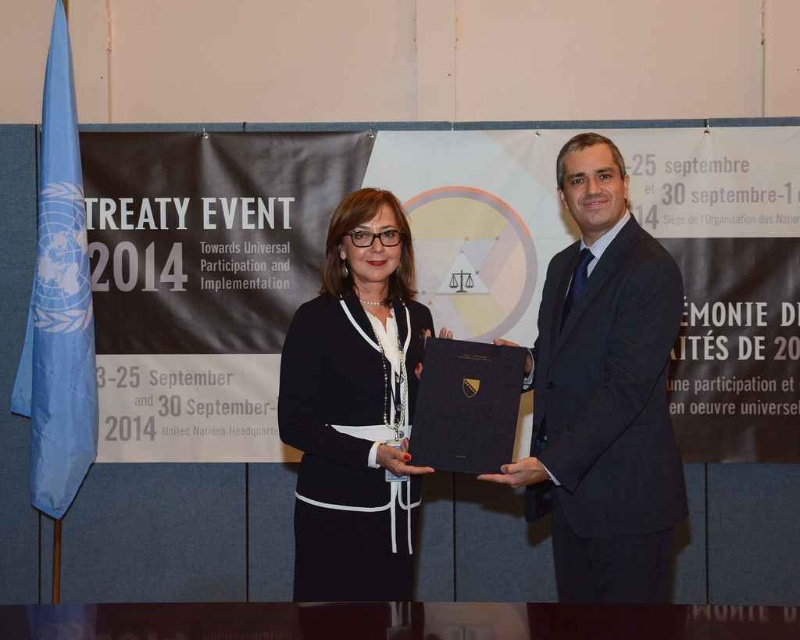
You are organizing a formal event and need to seat two guests based on their attire. The guests are wearing the black suit at right and the black matte jacket at center. If the seating arrangement requires placing the guest with the wider clothing first, which guest should be seated first?

The black suit at right should be seated first because its width is larger than the black matte jacket at center, making it the wider clothing.

From the picture: You are standing at the center of the image and want to move towards the black suit at right. In which direction should you move?

You should move to the right since the black suit at right is located at point 0.616 on the x axis, which is to the right of the center position.